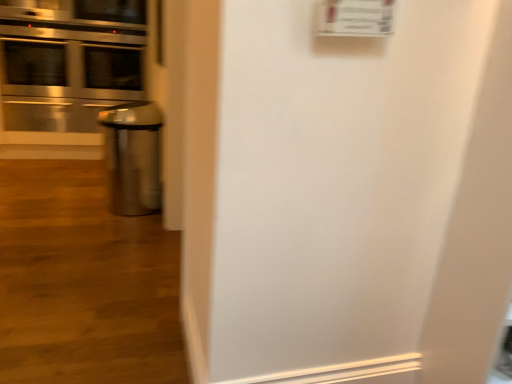
This screenshot has height=384, width=512. I want to click on vacant space to the left of shiny metallic trash can at center, so click(70, 210).